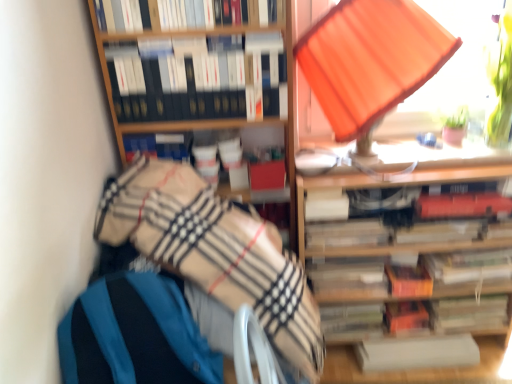
Question: Considering the relative sizes of hardcover book at center, positioned as the 3th paperback book in top-to-bottom order, and beige plaid blanket at lower left in the image provided, is hardcover book at center, positioned as the 3th paperback book in top-to-bottom order, bigger than beige plaid blanket at lower left?

Choices:
 (A) no
 (B) yes

Answer: (A)

Question: Is hardcover book at center, positioned as the 3th paperback book in top-to-bottom order, far away from beige plaid blanket at lower left?

Choices:
 (A) yes
 (B) no

Answer: (B)

Question: Is hardcover book at center, positioned as the 3th paperback book in top-to-bottom order, to the right of beige plaid blanket at lower left from the viewer's perspective?

Choices:
 (A) no
 (B) yes

Answer: (B)

Question: Considering the relative sizes of hardcover book at center, acting as the seventh paperback book starting from the bottom, and beige plaid blanket at lower left in the image provided, is hardcover book at center, acting as the seventh paperback book starting from the bottom, wider than beige plaid blanket at lower left?

Choices:
 (A) no
 (B) yes

Answer: (A)

Question: From the image's perspective, does hardcover book at center, acting as the seventh paperback book starting from the bottom, appear lower than beige plaid blanket at lower left?

Choices:
 (A) no
 (B) yes

Answer: (A)

Question: Is hardcover book at center, positioned as the 3th paperback book in top-to-bottom order, closer to camera compared to beige plaid blanket at lower left?

Choices:
 (A) no
 (B) yes

Answer: (A)

Question: From a real-world perspective, is blue fabric rocking chair at lower left beneath hardcover book at center, arranged as the 4th paperback book when viewed from the top?

Choices:
 (A) no
 (B) yes

Answer: (A)

Question: Does blue fabric rocking chair at lower left lie in front of hardcover book at center, arranged as the 4th paperback book when viewed from the top?

Choices:
 (A) no
 (B) yes

Answer: (B)

Question: Is blue fabric rocking chair at lower left positioned with its back to hardcover book at center, arranged as the 4th paperback book when viewed from the top?

Choices:
 (A) no
 (B) yes

Answer: (A)

Question: From the image's perspective, does blue fabric rocking chair at lower left appear higher than hardcover book at center, arranged as the 6th paperback book when ordered from the bottom?

Choices:
 (A) yes
 (B) no

Answer: (B)

Question: Is blue fabric rocking chair at lower left shorter than hardcover book at center, arranged as the 4th paperback book when viewed from the top?

Choices:
 (A) no
 (B) yes

Answer: (A)

Question: Is hardcover book at center, arranged as the 6th paperback book when ordered from the bottom, inside blue fabric rocking chair at lower left?

Choices:
 (A) no
 (B) yes

Answer: (A)

Question: From the image's perspective, is white paper at lower right, marked as the 1th book in a bottom-to-top arrangement, below orange fabric lampshade at upper right?

Choices:
 (A) yes
 (B) no

Answer: (A)